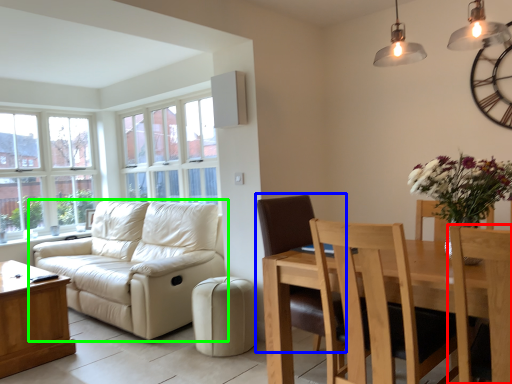
Question: Based on their relative distances, which object is nearer to chair (highlighted by a red box)? Choose from chair (highlighted by a blue box) and studio couch (highlighted by a green box).

Choices:
 (A) chair
 (B) studio couch

Answer: (A)